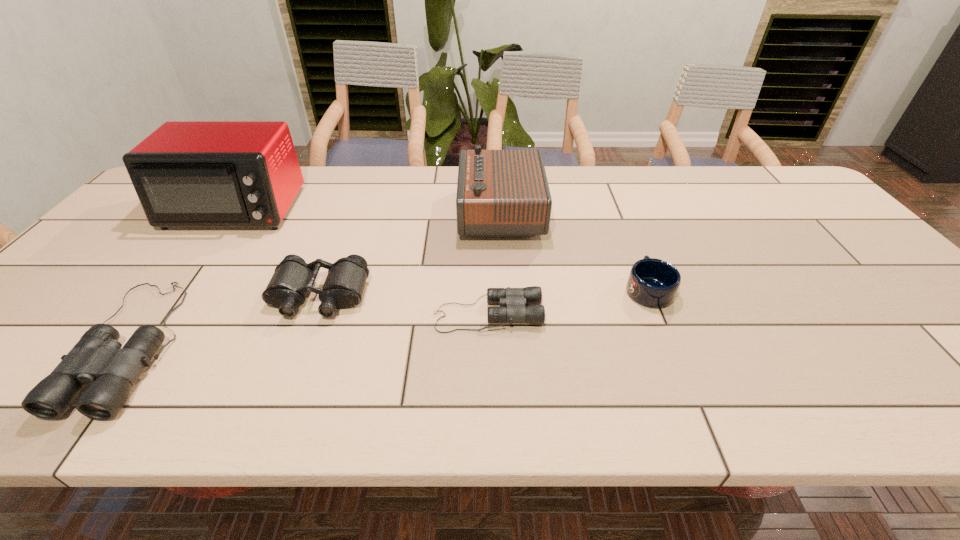
You are a GUI agent. You are given a task and a screenshot of the screen. Output one action in this format:
    pyautogui.click(x=<x>, y=<y>)
    Task: Click on the blank region between the shortest binoculars and the third object from left to right
    The height and width of the screenshot is (540, 960).
    Given the screenshot: What is the action you would take?
    pyautogui.click(x=404, y=306)

Find the location of a particular element. Image resolution: width=960 pixels, height=540 pixels. empty space that is in between the second tallest object and the mug is located at coordinates (574, 251).

Where is `free point between the leftmost binoculars and the fourth object from right to left`? The height and width of the screenshot is (540, 960). free point between the leftmost binoculars and the fourth object from right to left is located at coordinates (227, 320).

This screenshot has height=540, width=960. What are the coordinates of `blank region between the leftmost binoculars and the shortest object` in the screenshot? It's located at (310, 329).

Where is `free spot between the mug and the fourth object from right to left`? The image size is (960, 540). free spot between the mug and the fourth object from right to left is located at coordinates (484, 293).

You are a GUI agent. You are given a task and a screenshot of the screen. Output one action in this format:
    pyautogui.click(x=<x>, y=<y>)
    Task: Click on the blank region between the rightmost binoculars and the leftmost binoculars
    The image size is (960, 540).
    Given the screenshot: What is the action you would take?
    pyautogui.click(x=310, y=329)

You are a GUI agent. You are given a task and a screenshot of the screen. Output one action in this format:
    pyautogui.click(x=<x>, y=<y>)
    Task: Click on the free space between the leftmost binoculars and the second binoculars from left to right
    The width and height of the screenshot is (960, 540).
    Given the screenshot: What is the action you would take?
    pyautogui.click(x=227, y=320)

Locate an element on the screen. The height and width of the screenshot is (540, 960). free spot between the tallest object and the leftmost binoculars is located at coordinates (183, 277).

Select which object is the third closest to the second binoculars from left to right. Please provide its 2D coordinates. Your answer should be formatted as a tuple, i.e. [(x, y)], where the tuple contains the x and y coordinates of a point satisfying the conditions above.

[(186, 173)]

This screenshot has width=960, height=540. What are the coordinates of `object that is the third closest to the radio receiver` in the screenshot? It's located at (293, 278).